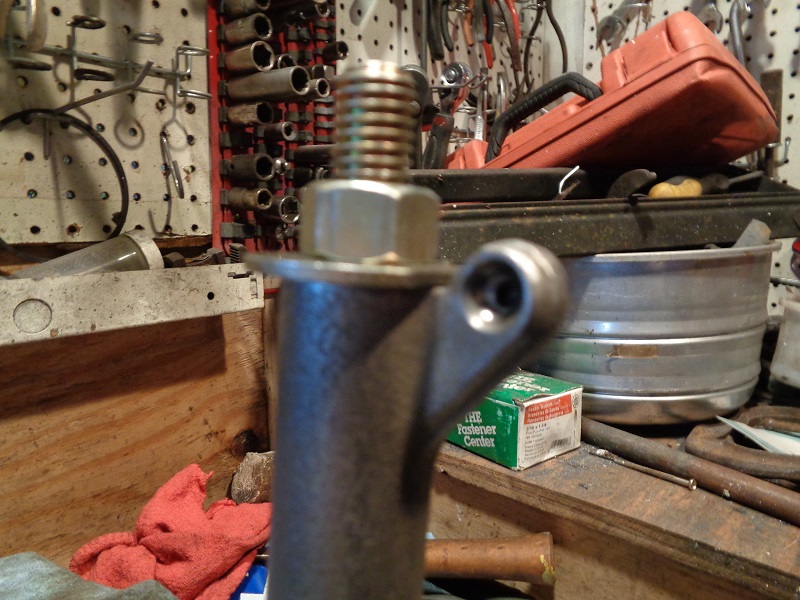
Locate an element on the screen. box is located at coordinates (528, 425).